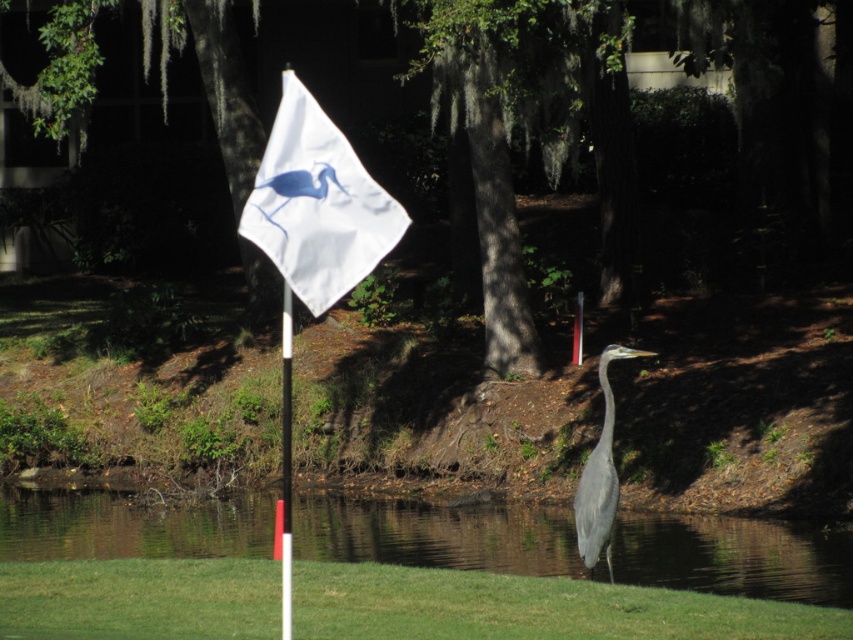
Between point (115, 628) and point (285, 321), which one is positioned in front?

Point (115, 628) is more forward.

Consider the image. Is green grass at lower right shorter than black glossy flag pole at center?

Yes, green grass at lower right is shorter than black glossy flag pole at center.

Does point (579, 602) lie behind point (288, 580)?

That is True.

Where is `green grass at lower right`? green grass at lower right is located at coordinates (531, 608).

Is point (582, 512) positioned in front of point (287, 572)?

No, it is behind (287, 572).

Is point (579, 509) farther from camera compared to point (285, 458)?

No, (579, 509) is closer to viewer.

You are a GUI agent. You are given a task and a screenshot of the screen. Output one action in this format:
    pyautogui.click(x=<x>, y=<y>)
    Task: Click on the gray matte bird at center
    
    Given the screenshot: What is the action you would take?
    pyautogui.click(x=601, y=476)

Is point (354, 195) positioned before point (283, 458)?

Yes, point (354, 195) is closer to viewer.

Based on the photo, measure the distance between white fabric flag at center and camera.

white fabric flag at center and camera are 23.74 feet apart.

Find the location of a particular element. The width and height of the screenshot is (853, 640). white fabric flag at center is located at coordinates (317, 204).